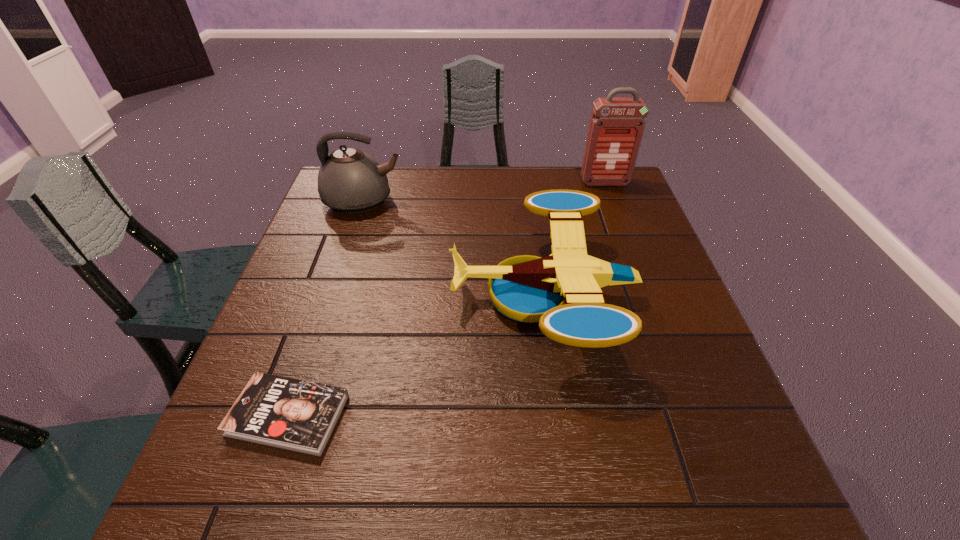
Where is `vacant space that satisfies the following two spatial constraints: 1. on the front-facing side of the tallest object; 2. at the cockpit of the drone`? Image resolution: width=960 pixels, height=540 pixels. vacant space that satisfies the following two spatial constraints: 1. on the front-facing side of the tallest object; 2. at the cockpit of the drone is located at coordinates (647, 295).

Find the location of a particular element. vacant area that satisfies the following two spatial constraints: 1. on the front-facing side of the tallest object; 2. at the cockpit of the drone is located at coordinates (647, 295).